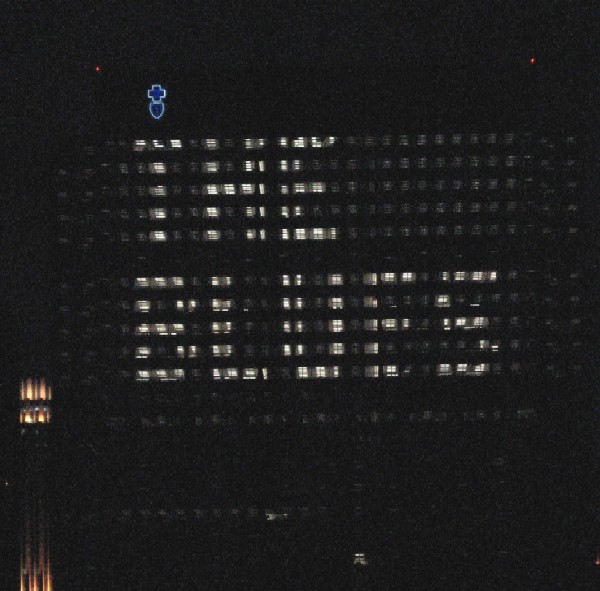
Locate an element on the screen. neon light is located at coordinates (159, 102).